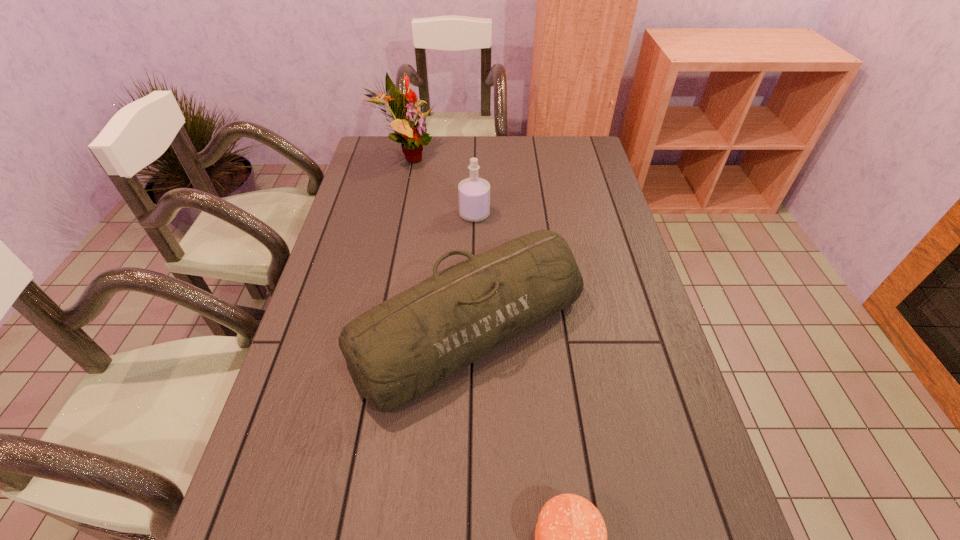
You are a GUI agent. You are given a task and a screenshot of the screen. Output one action in this format:
    pyautogui.click(x=<x>, y=<y>)
    Task: Click on the object located in the far left corner section of the desktop
    The image size is (960, 540).
    Given the screenshot: What is the action you would take?
    pyautogui.click(x=414, y=137)

In the image, there is a desktop. Where is `vacant space at the far edge`? vacant space at the far edge is located at coordinates (444, 166).

Identify the location of vacant space at the left edge of the desktop. (389, 206).

In the image, there is a desktop. Where is `vacant space at the right edge`? The width and height of the screenshot is (960, 540). vacant space at the right edge is located at coordinates (x=682, y=538).

Locate an element on the screen. The width and height of the screenshot is (960, 540). vacant space at the far left corner of the desktop is located at coordinates (400, 136).

In the image, there is a desktop. Identify the location of blank space at the far right corner. (561, 153).

You are a GUI agent. You are given a task and a screenshot of the screen. Output one action in this format:
    pyautogui.click(x=<x>, y=<y>)
    Task: Click on the vacant space that is in between the bouquet and the duffel bag
    
    Given the screenshot: What is the action you would take?
    pyautogui.click(x=437, y=242)

I want to click on object that stands as the third closest to the patty, so click(414, 137).

Point out which object is positioned as the nearest to the duffel bag. Please provide its 2D coordinates. Your answer should be formatted as a tuple, i.e. [(x, y)], where the tuple contains the x and y coordinates of a point satisfying the conditions above.

[(474, 193)]